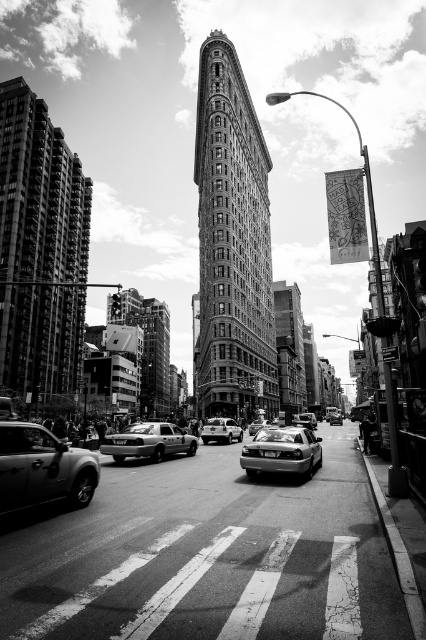
Question: Does matte silver truck at lower left appear over metallic silver sedan at center?

Choices:
 (A) yes
 (B) no

Answer: (A)

Question: Is silver metallic sedan at center wider than white glossy taxi at center?

Choices:
 (A) yes
 (B) no

Answer: (A)

Question: Which of the following is the closest to the observer?

Choices:
 (A) matte silver truck at lower left
 (B) silver metallic sedan at center
 (C) white glossy taxi at center

Answer: (A)

Question: In this image, where is silver metallic taxi at center located relative to white glossy taxi at center?

Choices:
 (A) above
 (B) below

Answer: (A)

Question: Which point appears farthest from the camera in this image?

Choices:
 (A) (77, 449)
 (B) (310, 449)
 (C) (224, 422)

Answer: (C)

Question: Based on their relative distances, which object is nearer to the silver metallic taxi at center?

Choices:
 (A) white glossy taxi at center
 (B) matte silver truck at lower left
 (C) silver metallic sedan at center

Answer: (A)